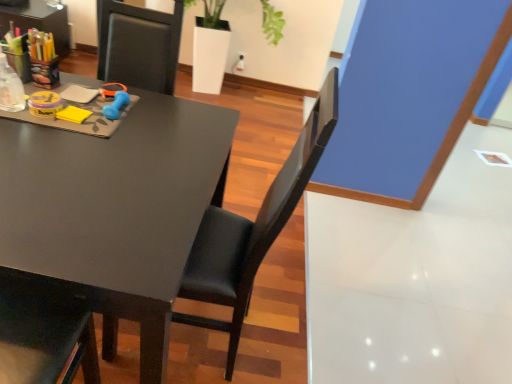
Question: Is matte black desk at left completely or partially outside of white glossy planter at upper center?

Choices:
 (A) no
 (B) yes

Answer: (B)

Question: Is matte black desk at left closer to camera compared to white glossy planter at upper center?

Choices:
 (A) no
 (B) yes

Answer: (B)

Question: Is matte black desk at left not near white glossy planter at upper center?

Choices:
 (A) yes
 (B) no

Answer: (A)

Question: From a real-world perspective, is matte black desk at left on white glossy planter at upper center?

Choices:
 (A) no
 (B) yes

Answer: (A)

Question: Is white glossy planter at upper center completely or partially inside matte black desk at left?

Choices:
 (A) yes
 (B) no

Answer: (B)

Question: Would you say matte black desk at left is to the left or to the right of blue plastic scissors at upper center in the picture?

Choices:
 (A) left
 (B) right

Answer: (A)

Question: Relative to blue plastic scissors at upper center, is matte black desk at left in front or behind?

Choices:
 (A) behind
 (B) front

Answer: (B)

Question: Looking at the image, does matte black desk at left seem bigger or smaller compared to blue plastic scissors at upper center?

Choices:
 (A) small
 (B) big

Answer: (B)

Question: Considering the positions of point (95, 241) and point (116, 82), is point (95, 241) closer or farther from the camera than point (116, 82)?

Choices:
 (A) farther
 (B) closer

Answer: (B)

Question: From the image's perspective, is white glossy planter at upper center located above or below black leather chair at center?

Choices:
 (A) below
 (B) above

Answer: (B)

Question: In terms of size, does white glossy planter at upper center appear bigger or smaller than black leather chair at center?

Choices:
 (A) big
 (B) small

Answer: (A)

Question: Considering the positions of point (264, 0) and point (282, 200), is point (264, 0) closer or farther from the camera than point (282, 200)?

Choices:
 (A) closer
 (B) farther

Answer: (B)

Question: From a real-world perspective, is white glossy planter at upper center physically located above or below black leather chair at center?

Choices:
 (A) above
 (B) below

Answer: (B)

Question: Visually, is black leather chair at center positioned to the left or to the right of matte black desk at left?

Choices:
 (A) right
 (B) left

Answer: (A)

Question: Is black leather chair at center spatially inside matte black desk at left, or outside of it?

Choices:
 (A) inside
 (B) outside

Answer: (A)